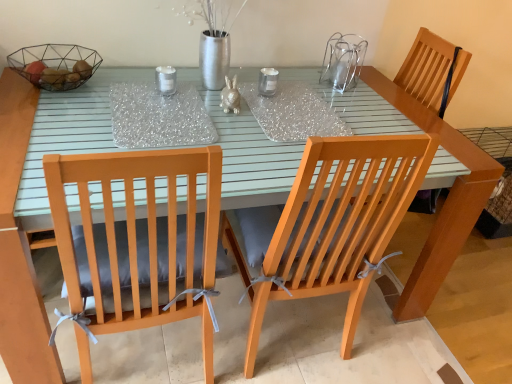
Question: Looking at the image, does wooden chair at right seem bigger or smaller compared to metallic wire basket at upper left?

Choices:
 (A) big
 (B) small

Answer: (A)

Question: Choose the correct answer: Is wooden chair at right inside metallic wire basket at upper left or outside it?

Choices:
 (A) inside
 (B) outside

Answer: (B)

Question: Estimate the real-world distances between objects in this image. Which object is closer to the metallic wire basket at upper left?

Choices:
 (A) matte gray cushion at left, marked as the first chair in a left-to-right arrangement
 (B) wooden chair with ribbons at center, placed as the 2th chair when sorted from left to right
 (C) wooden chair at right

Answer: (A)

Question: Estimate the real-world distances between objects in this image. Which object is farther from the wooden chair with ribbons at center, marked as the first chair in a right-to-left arrangement?

Choices:
 (A) metallic wire basket at upper left
 (B) wooden chair at right
 (C) matte gray cushion at left, marked as the first chair in a left-to-right arrangement

Answer: (A)